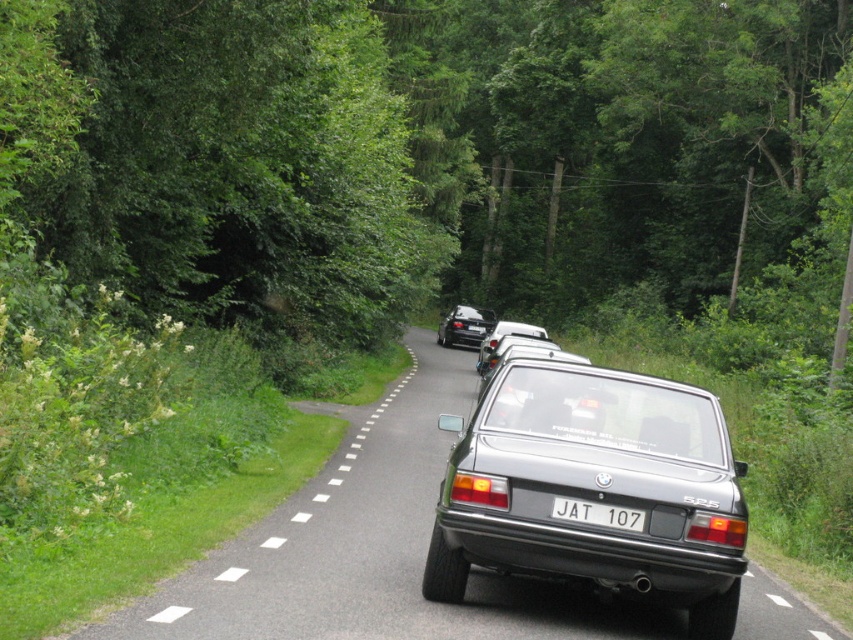
Question: Does shiny black sedan at center appear under white plastic line at center?

Choices:
 (A) yes
 (B) no

Answer: (B)

Question: Can you confirm if shiny black sedan at center is bigger than white plastic line at center?

Choices:
 (A) no
 (B) yes

Answer: (B)

Question: Is white dotted line at center wider than satin silver sedan at center?

Choices:
 (A) no
 (B) yes

Answer: (A)

Question: Among these points, which one is nearest to the camera?

Choices:
 (A) (238, 566)
 (B) (485, 355)
 (C) (277, 520)

Answer: (A)

Question: Which point is farther to the camera?

Choices:
 (A) shiny black sedan at center
 (B) white dotted line at center
 (C) metallic gray sedan at center
 (D) white plastic license plate at center

Answer: (A)

Question: Among these points, which one is nearest to the camera?

Choices:
 (A) (505, 321)
 (B) (488, 324)

Answer: (B)